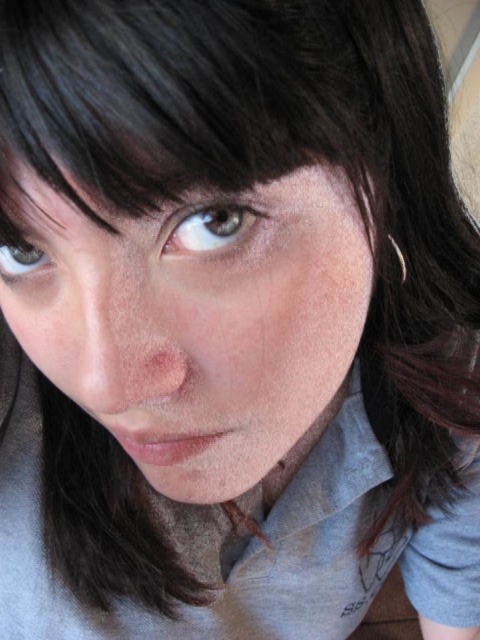
Question: Does smooth skin face at center have a greater width compared to brown matte eye at upper left?

Choices:
 (A) no
 (B) yes

Answer: (B)

Question: Estimate the real-world distances between objects in this image. Which object is closer to the brown matte eye at upper left?

Choices:
 (A) smooth skin face at center
 (B) brown matte eye at upper center

Answer: (B)

Question: Estimate the real-world distances between objects in this image. Which object is closer to the smooth skin face at center?

Choices:
 (A) brown matte eye at upper center
 (B) brown matte eye at upper left

Answer: (A)

Question: Is the position of smooth skin face at center more distant than that of brown matte eye at upper center?

Choices:
 (A) no
 (B) yes

Answer: (A)

Question: Which object is closer to the camera taking this photo?

Choices:
 (A) brown matte eye at upper left
 (B) brown matte eye at upper center

Answer: (B)

Question: Does smooth skin face at center appear under brown matte eye at upper left?

Choices:
 (A) no
 (B) yes

Answer: (B)